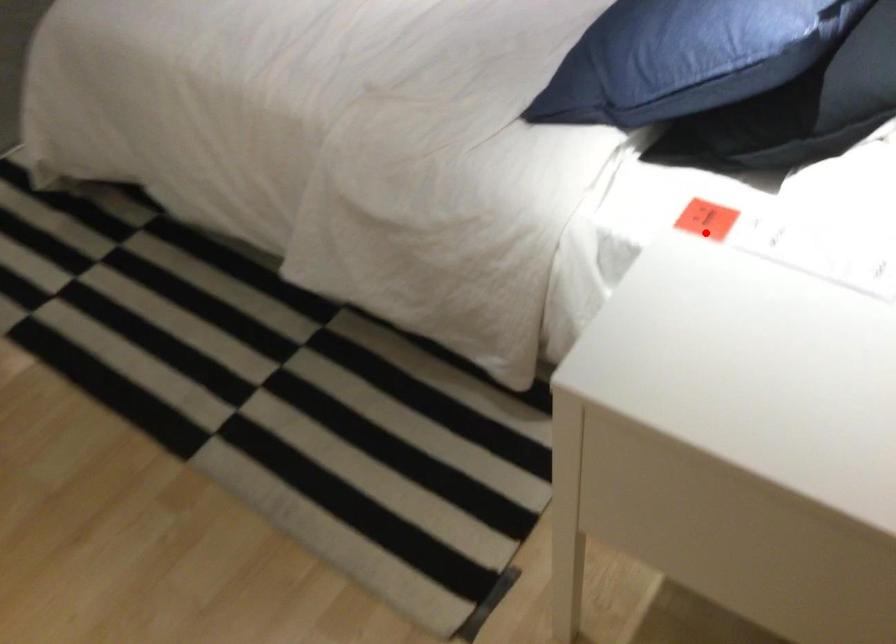
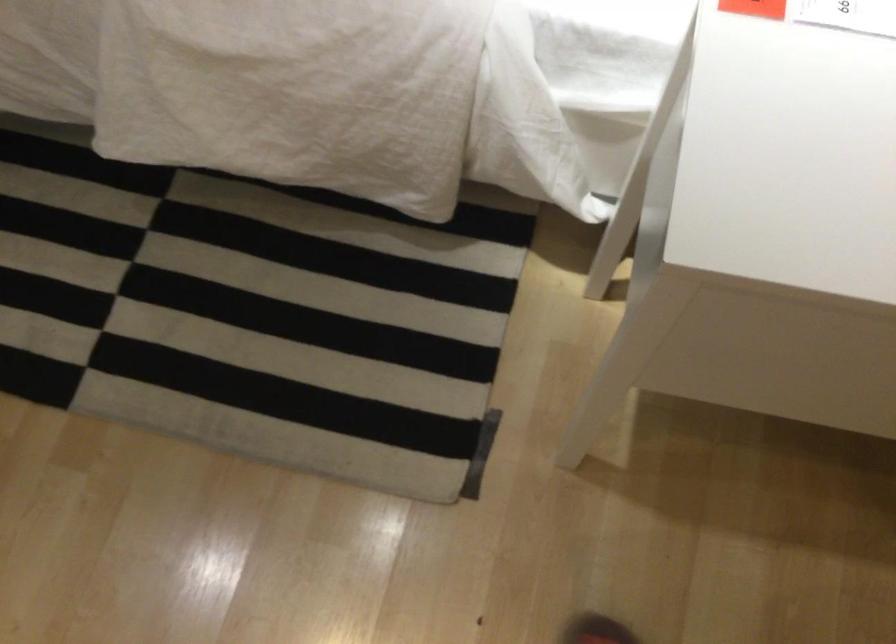
Question: A red point is marked in image1. In image2, is the corresponding 3D point closer to the camera or farther? Reply with the corresponding letter.

Choices:
 (A) The corresponding 3D point is closer.
 (B) The corresponding 3D point is farther.

Answer: (A)